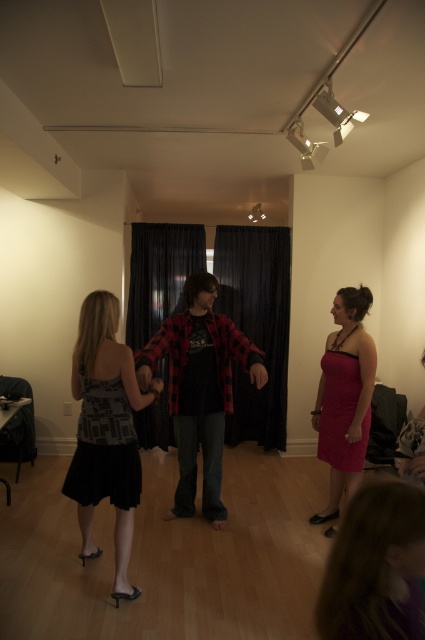
Who is shorter, red plaid shirt at center or matte pink dress at right?

matte pink dress at right

Measure the distance between red plaid shirt at center and camera.

The distance of red plaid shirt at center from camera is 9.00 feet.

Find the location of a particular element. The width and height of the screenshot is (425, 640). red plaid shirt at center is located at coordinates (200, 388).

Can you confirm if black satin dress at left is shorter than matte pink dress at right?

Indeed, black satin dress at left has a lesser height compared to matte pink dress at right.

Between black satin dress at left and matte pink dress at right, which one has more height?

With more height is matte pink dress at right.

Find the location of a particular element. The height and width of the screenshot is (640, 425). black satin dress at left is located at coordinates (105, 432).

You are a GUI agent. You are given a task and a screenshot of the screen. Output one action in this format:
    pyautogui.click(x=<x>, y=<y>)
    Task: Click on the black satin dress at left
    
    Given the screenshot: What is the action you would take?
    pyautogui.click(x=105, y=432)

Between black satin dress at left and red plaid shirt at center, which one is positioned lower?

black satin dress at left is lower down.

Who is positioned more to the left, black satin dress at left or red plaid shirt at center?

black satin dress at left

The image size is (425, 640). What are the coordinates of `black satin dress at left` in the screenshot? It's located at [105, 432].